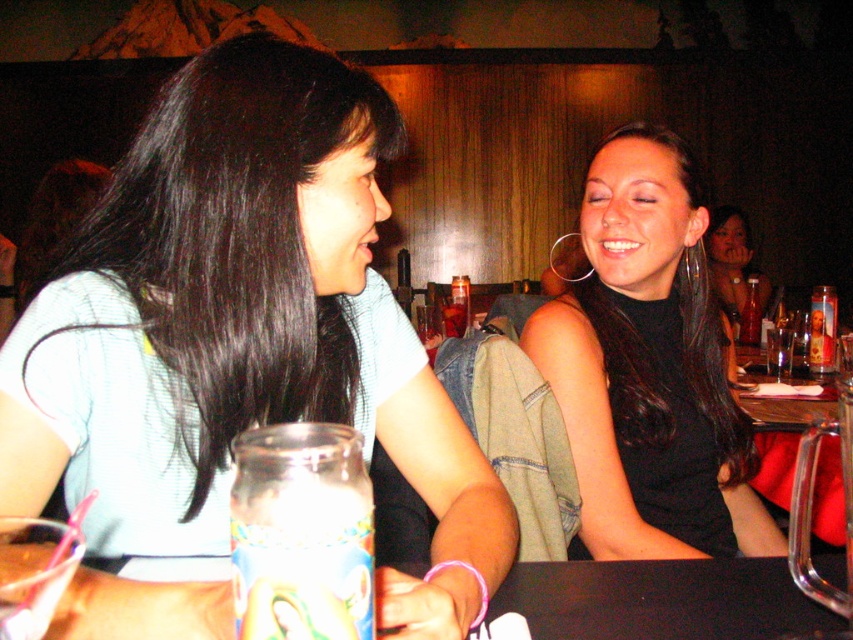
Question: Does smooth wooden table at center appear under matte black dress at center?

Choices:
 (A) yes
 (B) no

Answer: (A)

Question: Does matte blue shirt at upper left have a greater width compared to smooth wooden table at center?

Choices:
 (A) no
 (B) yes

Answer: (A)

Question: Which object is the closest to the smooth wooden table at center?

Choices:
 (A) matte black dress at center
 (B) black matte table at lower center

Answer: (B)

Question: Considering the real-world distances, which object is closest to the smooth wooden table at center?

Choices:
 (A) black matte table at lower center
 (B) black matte dress at center
 (C) matte blue shirt at upper left

Answer: (B)

Question: Can you confirm if black matte dress at center is thinner than matte black dress at center?

Choices:
 (A) yes
 (B) no

Answer: (A)

Question: Which object appears farthest from the camera in this image?

Choices:
 (A) matte black dress at center
 (B) matte blue shirt at upper left

Answer: (A)